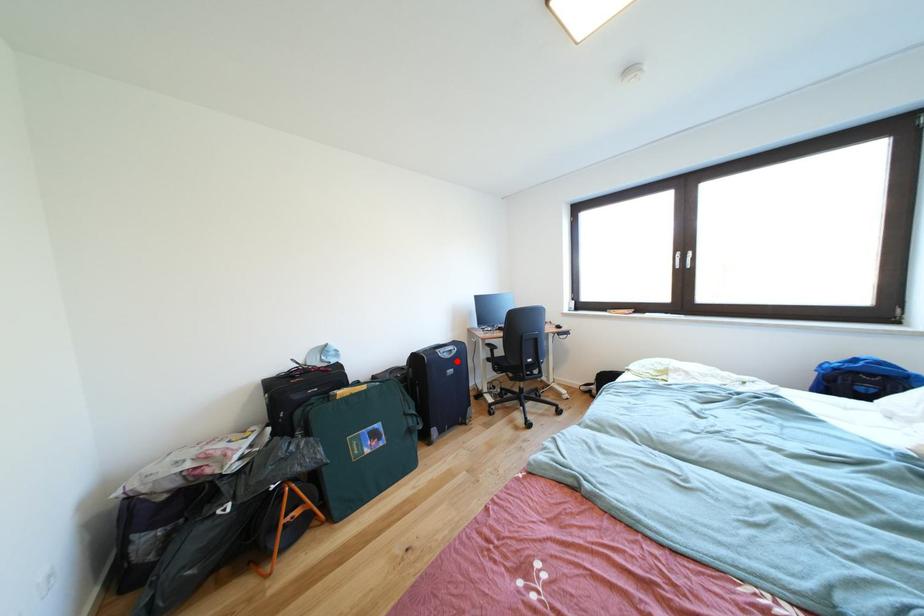
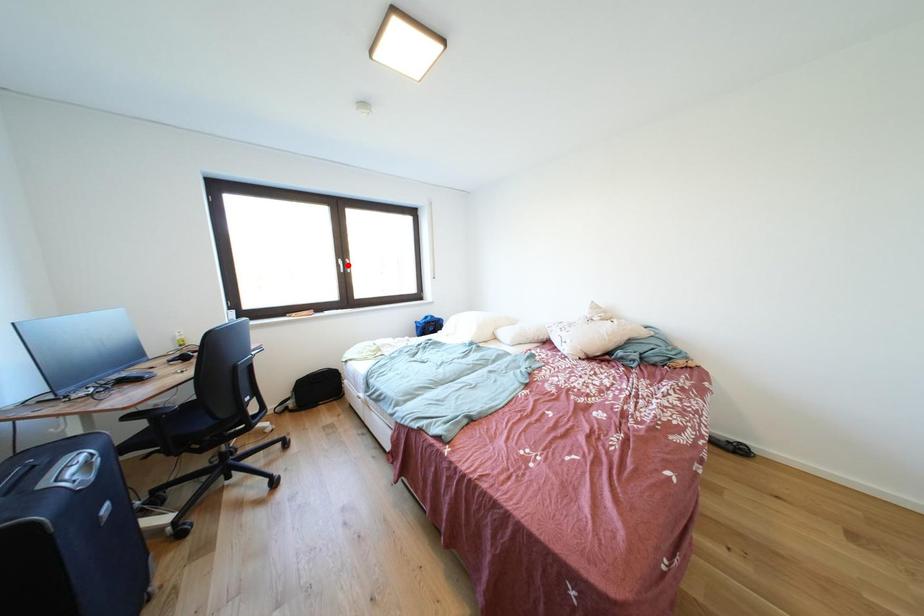
I am providing you with two images of the same scene from different viewpoints. A red point is marked on the first image and another point is marked on the second image. Is the red point in image1 aligned with the point shown in image2?

No